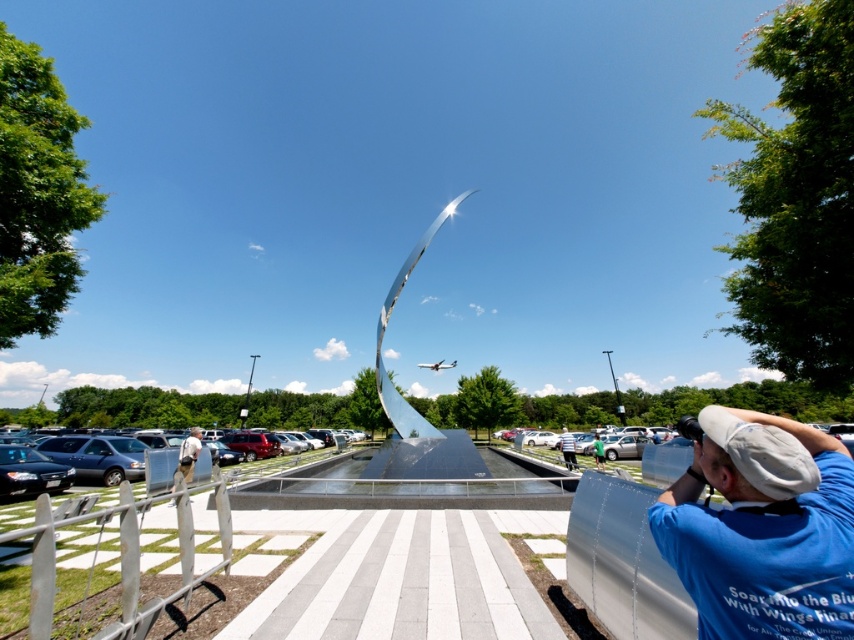
Which is behind, point (185, 452) or point (568, 454)?

Positioned behind is point (568, 454).

Who is taller, khaki cotton pants at lower left or white cotton shirt at center?

khaki cotton pants at lower left is taller.

The image size is (854, 640). I want to click on khaki cotton pants at lower left, so click(189, 452).

Is matte black sedan at lower left taller than khaki cotton pants at lower left?

In fact, matte black sedan at lower left may be shorter than khaki cotton pants at lower left.

This screenshot has width=854, height=640. What are the coordinates of `matte black sedan at lower left` in the screenshot? It's located at (110, 445).

Identify the location of matte black sedan at lower left. (110, 445).

Is blue cotton shirt at lower right shorter than white cotton shirt at center?

Correct, blue cotton shirt at lower right is not as tall as white cotton shirt at center.

Is point (773, 550) more distant than point (564, 456)?

No, (773, 550) is closer to viewer.

You are a GUI agent. You are given a task and a screenshot of the screen. Output one action in this format:
    pyautogui.click(x=<x>, y=<y>)
    Task: Click on the blue cotton shirt at lower right
    This screenshot has width=854, height=640.
    Given the screenshot: What is the action you would take?
    pyautogui.click(x=762, y=531)